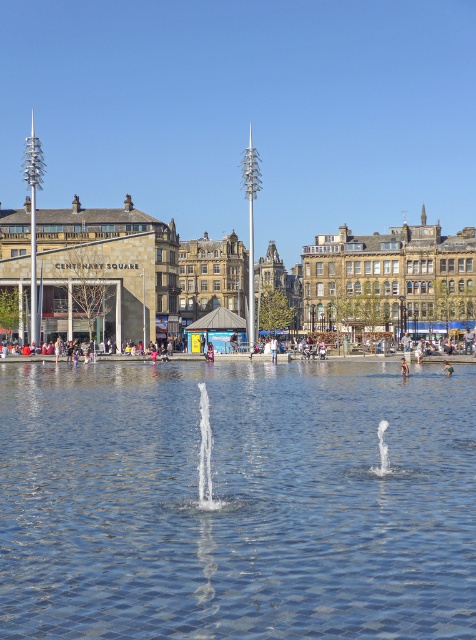
Does light blue jeans at center lie behind clear glass fountain at center?

Yes.

Does point (109, 356) come farther from viewer compared to point (208, 461)?

Yes, it is behind point (208, 461).

Is point (433, 355) closer to viewer compared to point (198, 497)?

No, it is not.

The height and width of the screenshot is (640, 476). What are the coordinates of `light blue jeans at center` in the screenshot? It's located at (448, 358).

Does clear water at center have a greater width compared to light blue jeans at center?

Incorrect, clear water at center's width does not surpass light blue jeans at center's.

Can you confirm if clear water at center is positioned to the right of light blue jeans at center?

Indeed, clear water at center is positioned on the right side of light blue jeans at center.

What are the coordinates of `clear water at center` in the screenshot? It's located at (237, 502).

Can you confirm if clear water at center is positioned below white frothy water at center?

Yes.

Between clear water at center and white frothy water at center, which one has more height?

Standing taller between the two is clear water at center.

Where is `clear water at center`? clear water at center is located at coordinates (237, 502).